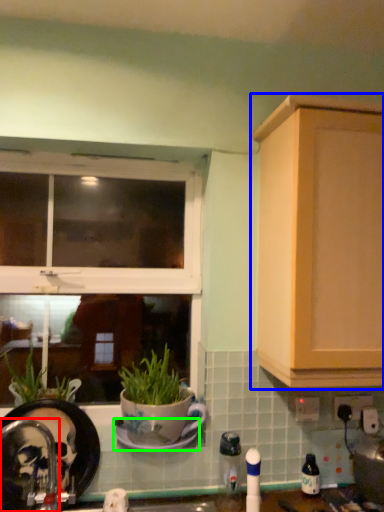
Question: Considering the real-world distances, which object is closest to faucet (highlighted by a red box)? cabinetry (highlighted by a blue box) or saucer (highlighted by a green box).

Choices:
 (A) cabinetry
 (B) saucer

Answer: (B)